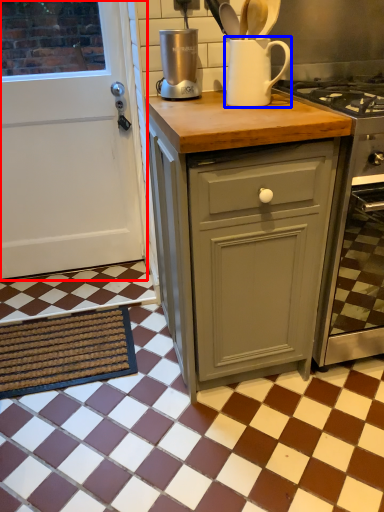
Question: Which point is further to the camera, door (highlighted by a red box) or jug (highlighted by a blue box)?

Choices:
 (A) door
 (B) jug

Answer: (A)